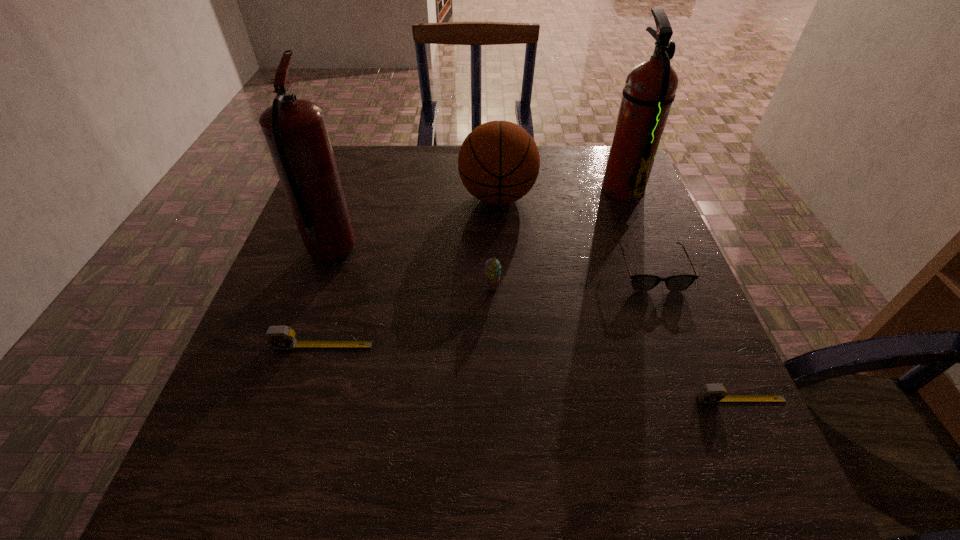
Identify the location of vacant space situated 0.390m on the left of the third tallest object. The height and width of the screenshot is (540, 960). (313, 197).

Where is `blank area located at the nozzle of the farther fire extinguisher`? blank area located at the nozzle of the farther fire extinguisher is located at coordinates (567, 188).

I want to click on free location located 0.240m at the nozzle of the farther fire extinguisher, so click(513, 188).

Image resolution: width=960 pixels, height=540 pixels. I want to click on free point located 0.400m at the nozzle of the farther fire extinguisher, so click(x=454, y=188).

I want to click on free space located at the front view of the spectacles, so click(x=681, y=350).

At what (x,y) coordinates should I click in order to perform the action: click on vacant space positioned 0.120m on the handle side the nearer fire extinguisher. Please return your answer as a coordinate pair (x, y). Looking at the image, I should click on (350, 200).

Identify the location of vacant space located 0.150m on the handle side the nearer fire extinguisher. The height and width of the screenshot is (540, 960). click(352, 193).

Where is `vacant space located 0.190m on the handle side the nearer fire extinguisher`? Image resolution: width=960 pixels, height=540 pixels. vacant space located 0.190m on the handle side the nearer fire extinguisher is located at coordinates (355, 185).

At what (x,y) coordinates should I click in order to perform the action: click on vacant space located on the front of the sherbert. Please return your answer as a coordinate pair (x, y). Looking at the image, I should click on (493, 359).

Image resolution: width=960 pixels, height=540 pixels. What are the coordinates of `basketball that is positioned at the far edge` in the screenshot? It's located at (498, 163).